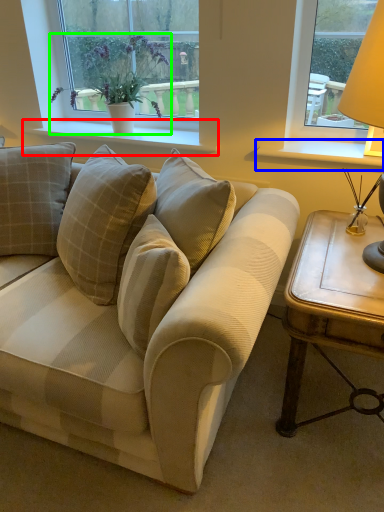
Question: Considering the real-world distances, which object is closest to window sill (highlighted by a red box)? window sill (highlighted by a blue box) or houseplant (highlighted by a green box).

Choices:
 (A) window sill
 (B) houseplant

Answer: (B)